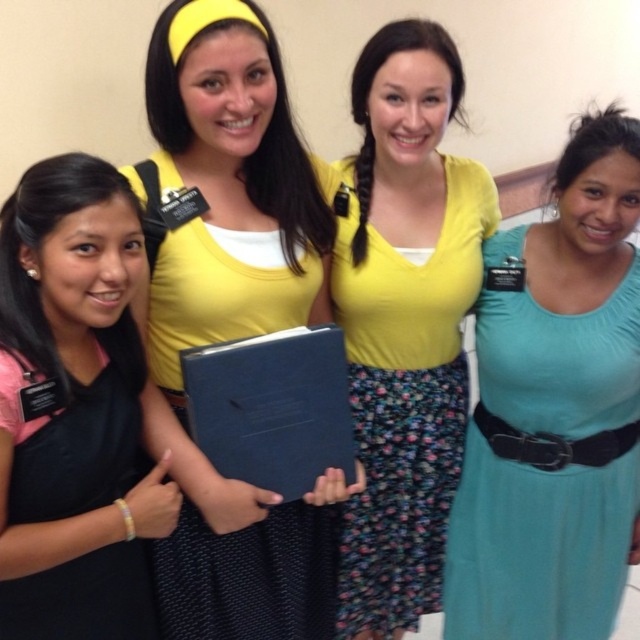
You are standing in the same room as the four women and want to move from the point at coordinate point (490, 545) to the point at coordinate point (387, 497). Is the destination point in front of or behind your starting position?

The destination point at coordinate point (387, 497) is behind your starting position at coordinate point (490, 545) because the Objects Description states that point (490, 545) is in front of point (387, 497).

You are a photographer setting up a tripod to take a group photo of the matte black book at center and the black matte dress at left. The minimum distance your tripod can handle between subjects is 1.5 inches. Can you safely set up the tripod for this shot?

The matte black book at center and the black matte dress at left are 1.67 inches apart from each other, which is greater than the tripod minimum requirement of 1.5 inches. Therefore, you can safely set up the tripod for this shot.

You are a photographer setting up for a group photo. You need to ensure there is enough space between the teal satin dress at right and the floral print fabric dress at center to avoid overlapping in the photo. The minimum required distance for no overlap is 8 inches. Is the current spacing sufficient?

The teal satin dress at right and floral print fabric dress at center are 7.53 inches apart, which is less than the required 8 inches. Therefore, the current spacing is insufficient to avoid overlapping in the photo.